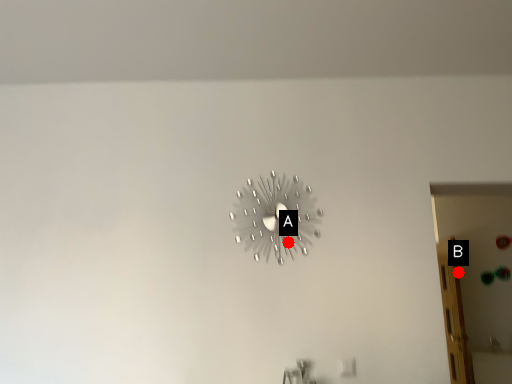
Question: Two points are circled on the image, labeled by A and B beside each circle. Which point is farther to the camera?

Choices:
 (A) A is further
 (B) B is further

Answer: (B)